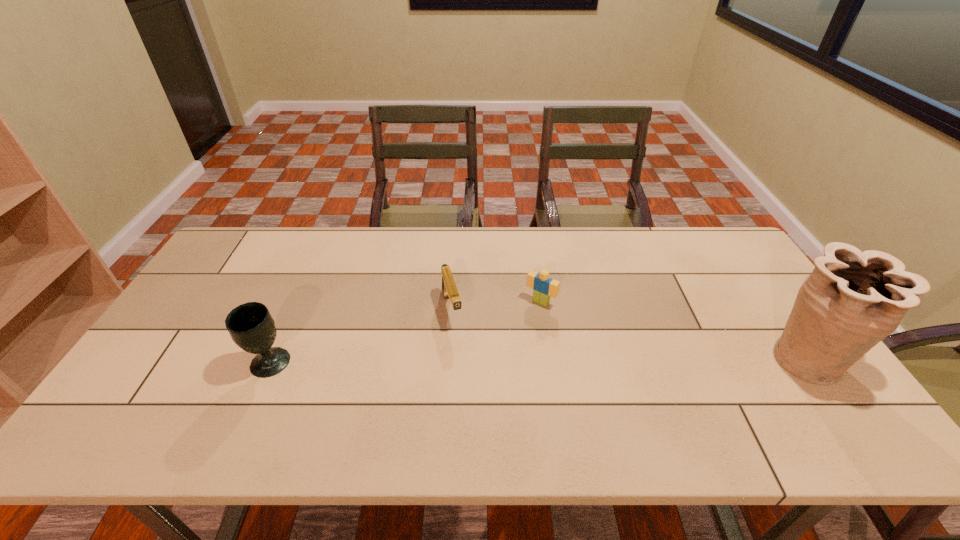
Locate an element on the screen. blank region between the Lego and the tallest object is located at coordinates (673, 330).

Where is `vacant area that lies between the third shortest object and the second object from left to right`? Image resolution: width=960 pixels, height=540 pixels. vacant area that lies between the third shortest object and the second object from left to right is located at coordinates (361, 336).

Where is `free spot between the tallest object and the chalice`? free spot between the tallest object and the chalice is located at coordinates (538, 361).

Identify which object is located as the nearest to the chalice. Please provide its 2D coordinates. Your answer should be formatted as a tuple, i.e. [(x, y)], where the tuple contains the x and y coordinates of a point satisfying the conditions above.

[(449, 288)]

Locate an element on the screen. The width and height of the screenshot is (960, 540). object that can be found as the second closest to the chalice is located at coordinates (543, 287).

Locate an element on the screen. This screenshot has width=960, height=540. vacant region that satisfies the following two spatial constraints: 1. on the back side of the rightmost object; 2. on the right side of the chalice is located at coordinates (272, 359).

The width and height of the screenshot is (960, 540). Find the location of `vacant position in the image that satisfies the following two spatial constraints: 1. on the front side of the second object from left to right; 2. on the left side of the tallest object`. vacant position in the image that satisfies the following two spatial constraints: 1. on the front side of the second object from left to right; 2. on the left side of the tallest object is located at coordinates (448, 359).

This screenshot has height=540, width=960. I want to click on free space that satisfies the following two spatial constraints: 1. on the front side of the rightmost object; 2. on the left side of the pistol, so click(x=448, y=359).

You are a GUI agent. You are given a task and a screenshot of the screen. Output one action in this format:
    pyautogui.click(x=<x>, y=<y>)
    Task: Click on the free spot that satisfies the following two spatial constraints: 1. on the front side of the third object from left to right; 2. on the left side of the tallest object
    The height and width of the screenshot is (540, 960).
    Given the screenshot: What is the action you would take?
    pyautogui.click(x=549, y=359)